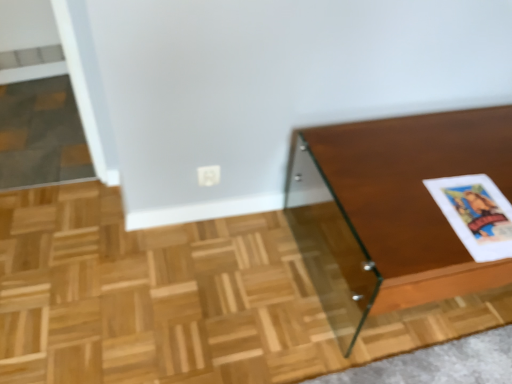
Question: Is white paper at right thinner than wooden glossy table at right?

Choices:
 (A) yes
 (B) no

Answer: (A)

Question: Is white paper at right oriented towards wooden glossy table at right?

Choices:
 (A) no
 (B) yes

Answer: (B)

Question: Is white paper at right not within wooden glossy table at right?

Choices:
 (A) yes
 (B) no

Answer: (B)

Question: From a real-world perspective, is white paper at right located beneath wooden glossy table at right?

Choices:
 (A) yes
 (B) no

Answer: (B)

Question: Considering the relative sizes of white paper at right and wooden glossy table at right in the image provided, is white paper at right shorter than wooden glossy table at right?

Choices:
 (A) no
 (B) yes

Answer: (B)

Question: Is white paper at right positioned with its back to wooden glossy table at right?

Choices:
 (A) no
 (B) yes

Answer: (B)

Question: Is wooden glossy table at right thinner than white paper at right?

Choices:
 (A) yes
 (B) no

Answer: (B)

Question: Is wooden glossy table at right shorter than white paper at right?

Choices:
 (A) no
 (B) yes

Answer: (A)

Question: From the image's perspective, would you say wooden glossy table at right is shown under white paper at right?

Choices:
 (A) yes
 (B) no

Answer: (A)

Question: Does wooden glossy table at right have a smaller size compared to white paper at right?

Choices:
 (A) yes
 (B) no

Answer: (B)

Question: From a real-world perspective, does wooden glossy table at right sit lower than white paper at right?

Choices:
 (A) yes
 (B) no

Answer: (A)

Question: Is wooden glossy table at right far away from white paper at right?

Choices:
 (A) no
 (B) yes

Answer: (A)

Question: Is wooden glossy table at right in front of or behind white paper at right in the image?

Choices:
 (A) behind
 (B) front

Answer: (B)